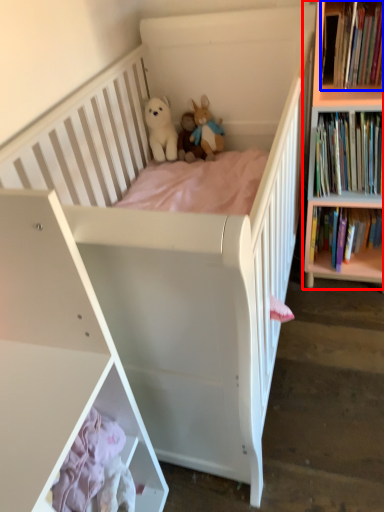
Question: Which point is closer to the camera, bookcase (highlighted by a red box) or book (highlighted by a blue box)?

Choices:
 (A) bookcase
 (B) book

Answer: (A)